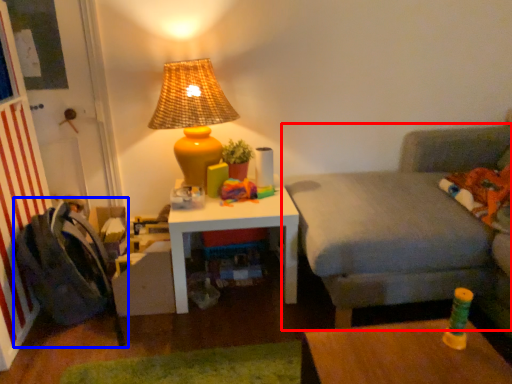
Question: Which object appears farthest to the camera in this image, studio couch (highlighted by a red box) or swivel chair (highlighted by a blue box)?

Choices:
 (A) studio couch
 (B) swivel chair

Answer: (B)